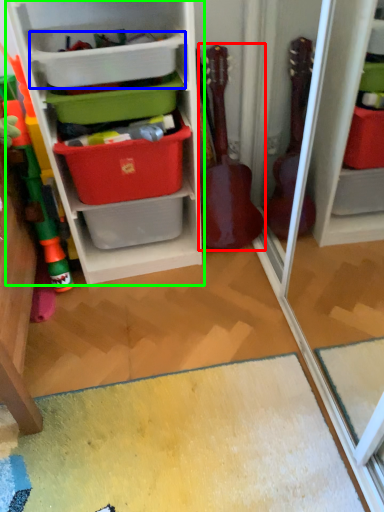
Question: Which is nearer to the guitar (highlighted by a red box)? storage box (highlighted by a blue box) or shelf (highlighted by a green box).

Choices:
 (A) storage box
 (B) shelf

Answer: (B)